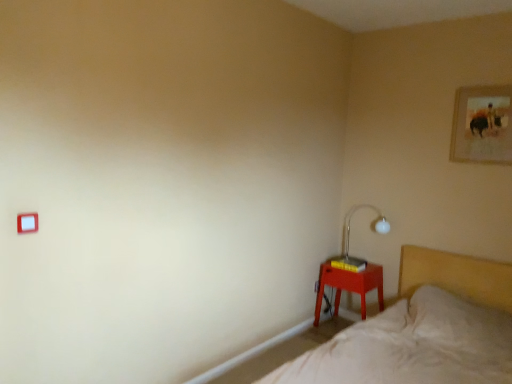
Question: Is white plastic light switch at upper left at the left side of gold-framed picture at upper right?

Choices:
 (A) no
 (B) yes

Answer: (B)

Question: Are white plastic light switch at upper left and gold-framed picture at upper right located far from each other?

Choices:
 (A) yes
 (B) no

Answer: (A)

Question: From the image's perspective, does white plastic light switch at upper left appear higher than gold-framed picture at upper right?

Choices:
 (A) yes
 (B) no

Answer: (B)

Question: Is white plastic light switch at upper left outside of gold-framed picture at upper right?

Choices:
 (A) no
 (B) yes

Answer: (B)

Question: Can you confirm if white plastic light switch at upper left is positioned to the right of gold-framed picture at upper right?

Choices:
 (A) yes
 (B) no

Answer: (B)

Question: Choose the correct answer: Is matte plastic nightstand at lower right inside beige fabric bed at lower right or outside it?

Choices:
 (A) outside
 (B) inside

Answer: (A)

Question: From the image's perspective, is matte plastic nightstand at lower right positioned above or below beige fabric bed at lower right?

Choices:
 (A) above
 (B) below

Answer: (A)

Question: Is matte plastic nightstand at lower right wider or thinner than beige fabric bed at lower right?

Choices:
 (A) thin
 (B) wide

Answer: (A)

Question: Does point (352, 276) appear closer or farther from the camera than point (486, 264)?

Choices:
 (A) closer
 (B) farther

Answer: (B)

Question: Is gold-framed picture at upper right situated inside white plastic light switch at upper left or outside?

Choices:
 (A) outside
 (B) inside

Answer: (A)

Question: Considering the positions of gold-framed picture at upper right and white plastic light switch at upper left in the image, is gold-framed picture at upper right bigger or smaller than white plastic light switch at upper left?

Choices:
 (A) big
 (B) small

Answer: (A)

Question: From a real-world perspective, is gold-framed picture at upper right physically located above or below white plastic light switch at upper left?

Choices:
 (A) below
 (B) above

Answer: (B)

Question: From their relative heights in the image, would you say gold-framed picture at upper right is taller or shorter than white plastic light switch at upper left?

Choices:
 (A) tall
 (B) short

Answer: (A)

Question: Looking at their shapes, would you say beige fabric bed at lower right is wider or thinner than gold-framed picture at upper right?

Choices:
 (A) wide
 (B) thin

Answer: (A)

Question: From their relative heights in the image, would you say beige fabric bed at lower right is taller or shorter than gold-framed picture at upper right?

Choices:
 (A) short
 (B) tall

Answer: (B)